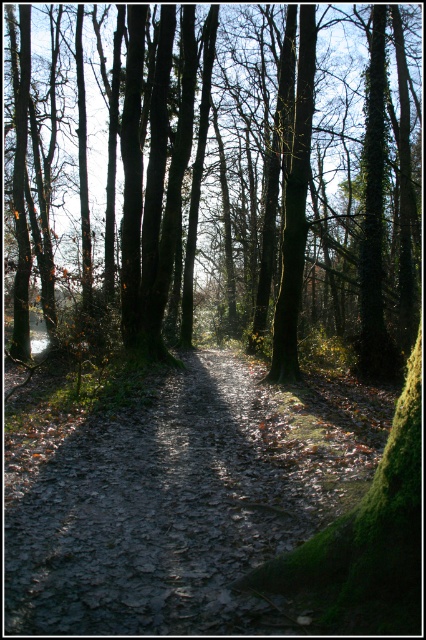
Question: Where is green mossy tree at center located in relation to muddy dirt path at center in the image?

Choices:
 (A) above
 (B) below

Answer: (A)

Question: Which of the following is the closest to the observer?

Choices:
 (A) green mossy tree at center
 (B) muddy dirt path at center

Answer: (B)

Question: Among these points, which one is farthest from the camera?

Choices:
 (A) (89, 552)
 (B) (268, 214)

Answer: (B)

Question: Does green mossy tree at center have a smaller size compared to muddy dirt path at center?

Choices:
 (A) no
 (B) yes

Answer: (A)

Question: Does green mossy tree at center lie behind muddy dirt path at center?

Choices:
 (A) yes
 (B) no

Answer: (A)

Question: Which point is closer to the camera taking this photo?

Choices:
 (A) (403, 220)
 (B) (118, 525)

Answer: (B)